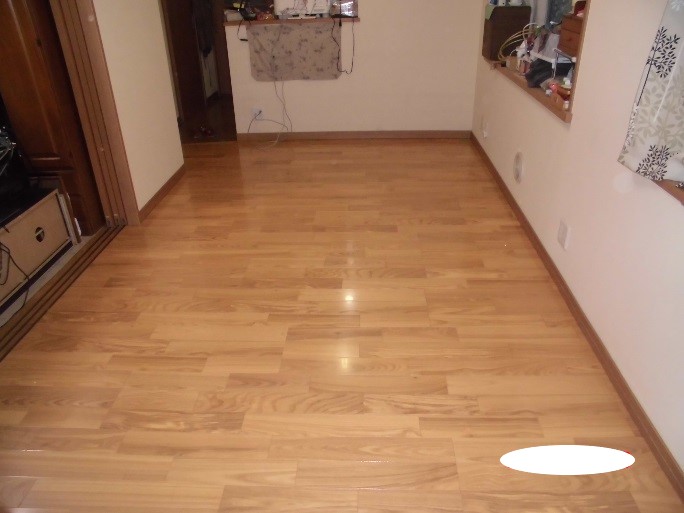
Identify the location of floor. The image size is (684, 513). (337, 300).